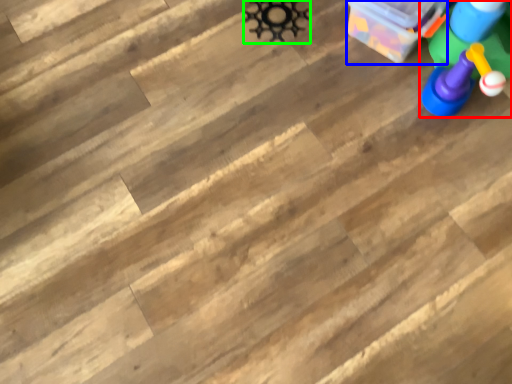
Question: Which object is the closest to the toy (highlighted by a red box)? Choose among these: cardboard box (highlighted by a blue box) or toy (highlighted by a green box).

Choices:
 (A) cardboard box
 (B) toy

Answer: (A)